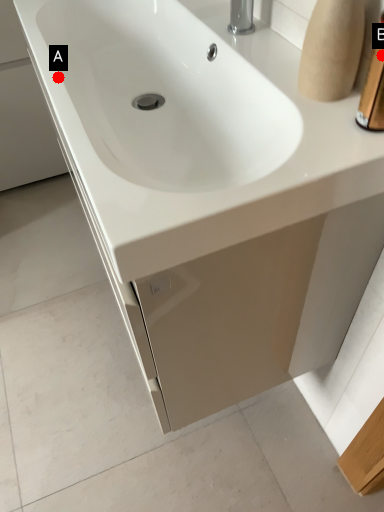
Question: Two points are circled on the image, labeled by A and B beside each circle. Which of the following is the closest to the observer?

Choices:
 (A) A is closer
 (B) B is closer

Answer: (B)